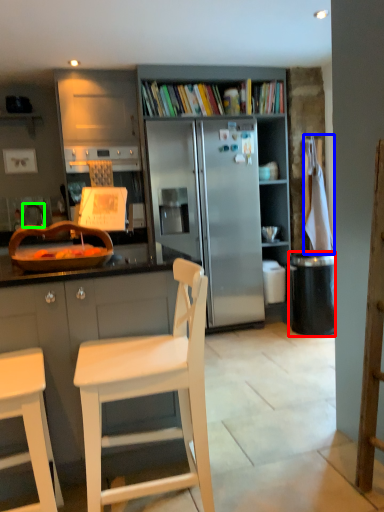
Question: Which object is positioned closest to trash bin/can (highlighted by a red box)? Select from towel/napkin (highlighted by a blue box) and faucet (highlighted by a green box).

Choices:
 (A) towel/napkin
 (B) faucet

Answer: (A)